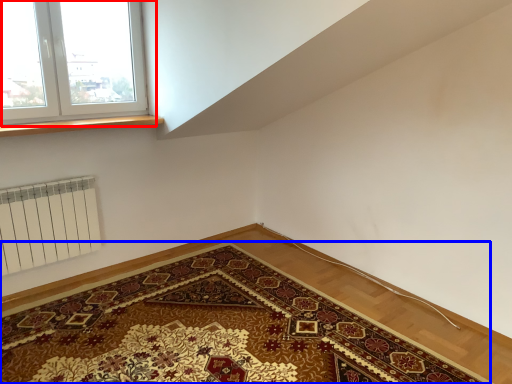
Question: Among these objects, which one is nearest to the camera, window (highlighted by a red box) or mat (highlighted by a blue box)?

Choices:
 (A) window
 (B) mat

Answer: (B)